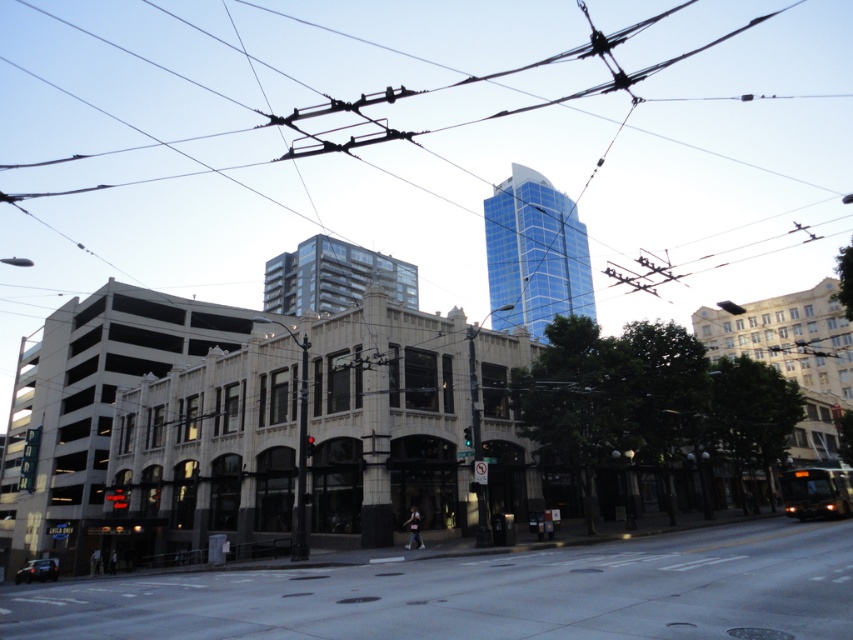
You are a city planner analyzing this urban scene. You need to determine which object occupies more space in the image. Based on the scene, which one is larger in size between the concrete sidewalk at lower center and the blue glassy tower at upper center?

The blue glassy tower at upper center is larger in size compared to the concrete sidewalk at lower center according to the description.

You are a drone operator tasked with capturing aerial footage of the blue glassy tower at upper center. The drone must fly from the overhead electric wires to the tower. Based on their positions, will the drone need to ascend or descend to reach the tower?

The blue glassy tower at upper center is located at point (535, 252). Since the overhead electric wires are part of the trolleybus system running parallel to the street and the tower is positioned at upper center, the drone would need to ascend to reach the tower from the wires.

You are a pedestrian standing on the concrete sidewalk at lower center. Looking ahead, you see the metallic wires at upper center overhead. Can you walk straight ahead without ducking under the wires?

The concrete sidewalk at lower center is behind metallic wires at upper center, meaning the wires are in front of the sidewalk. Since the wires are overhead, they are elevated and you can walk straight ahead without needing to duck.